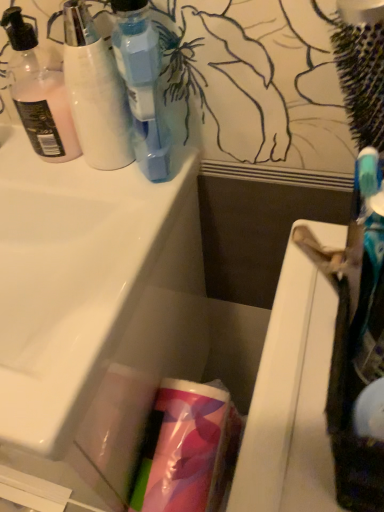
Question: Is translucent pink lotion at left, which is the third bottle from right to left, turned away from white glossy sink at center?

Choices:
 (A) yes
 (B) no

Answer: (B)

Question: Does translucent pink lotion at left, which is the first bottle in left-to-right order, appear on the right side of white glossy sink at center?

Choices:
 (A) no
 (B) yes

Answer: (B)

Question: Does translucent pink lotion at left, which is the third bottle from right to left, have a lesser width compared to white glossy sink at center?

Choices:
 (A) no
 (B) yes

Answer: (B)

Question: Is translucent pink lotion at left, which is the third bottle from right to left, outside of white glossy sink at center?

Choices:
 (A) yes
 (B) no

Answer: (A)

Question: Can you confirm if translucent pink lotion at left, which is the third bottle from right to left, is wider than white glossy sink at center?

Choices:
 (A) no
 (B) yes

Answer: (A)

Question: Is translucent plastic bottle at upper left, which is the second bottle from right to left, bigger or smaller than translucent plastic roll at center?

Choices:
 (A) small
 (B) big

Answer: (A)

Question: From the image's perspective, relative to translucent plastic roll at center, is translucent plastic bottle at upper left, which is the second bottle from right to left, above or below?

Choices:
 (A) above
 (B) below

Answer: (A)

Question: Considering their positions, is translucent plastic bottle at upper left, the 2th bottle positioned from the left, located in front of or behind translucent plastic roll at center?

Choices:
 (A) front
 (B) behind

Answer: (A)

Question: Is translucent plastic bottle at upper left, which is the second bottle from right to left, inside the boundaries of translucent plastic roll at center, or outside?

Choices:
 (A) outside
 (B) inside

Answer: (A)

Question: From a real-world perspective, is translucent plastic roll at center physically located above or below transparent plastic bottle at upper left, which is the 3th bottle in left-to-right order?

Choices:
 (A) below
 (B) above

Answer: (A)

Question: In terms of width, does translucent plastic roll at center look wider or thinner when compared to transparent plastic bottle at upper left, the 1th bottle from the right?

Choices:
 (A) thin
 (B) wide

Answer: (B)

Question: Is translucent plastic roll at center inside the boundaries of transparent plastic bottle at upper left, which is the 3th bottle in left-to-right order, or outside?

Choices:
 (A) outside
 (B) inside

Answer: (A)

Question: Based on their positions, is translucent plastic roll at center located to the left or right of transparent plastic bottle at upper left, the 1th bottle from the right?

Choices:
 (A) right
 (B) left

Answer: (A)

Question: Is translucent plastic bottle at upper left, the 2th bottle positioned from the left, to the left or to the right of translucent pink lotion at left, which is the first bottle in left-to-right order, in the image?

Choices:
 (A) right
 (B) left

Answer: (A)

Question: From a real-world perspective, is translucent plastic bottle at upper left, which is the second bottle from right to left, physically located above or below translucent pink lotion at left, which is the third bottle from right to left?

Choices:
 (A) below
 (B) above

Answer: (B)